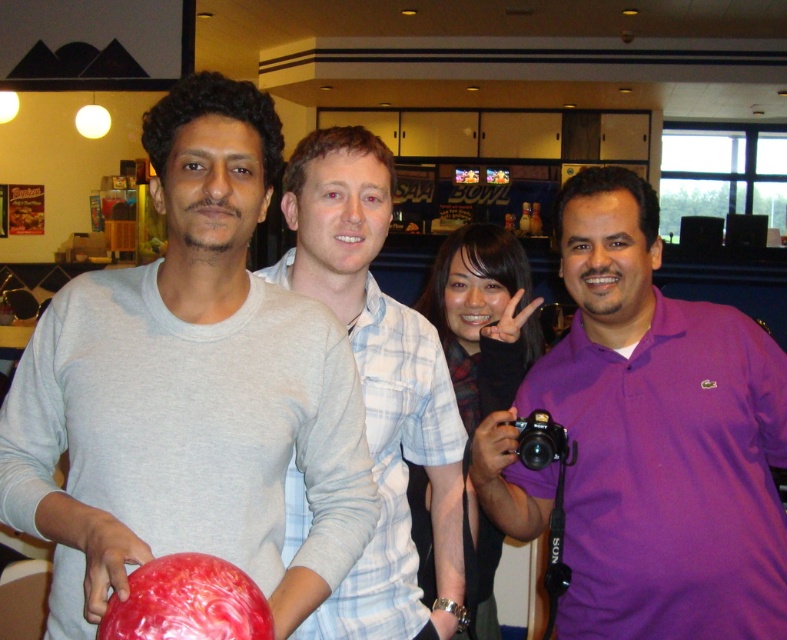
Is purple cotton shirt at right thinner than light blue plaid shirt at center?

Incorrect, purple cotton shirt at right's width is not less than light blue plaid shirt at center's.

Is point (737, 358) positioned behind point (409, 609)?

No, it is not.

Image resolution: width=787 pixels, height=640 pixels. I want to click on purple cotton shirt at right, so click(x=649, y=440).

Is matte gray sweater at left above light blue plaid shirt at center?

Indeed, matte gray sweater at left is positioned over light blue plaid shirt at center.

At what (x,y) coordinates should I click in order to perform the action: click on matte gray sweater at left. Please return your answer as a coordinate pair (x, y). Looking at the image, I should click on (189, 390).

Is point (220, 540) closer to viewer compared to point (364, 188)?

Yes, point (220, 540) is in front of point (364, 188).

Locate an element on the screen. Image resolution: width=787 pixels, height=640 pixels. matte gray sweater at left is located at coordinates (189, 390).

Is matte gray sweater at left smaller than purple cotton shirt at right?

Yes, matte gray sweater at left is smaller than purple cotton shirt at right.

Between point (355, 497) and point (641, 616), which one is positioned in front?

Point (355, 497)

Locate an element on the screen. This screenshot has height=640, width=787. matte gray sweater at left is located at coordinates (189, 390).